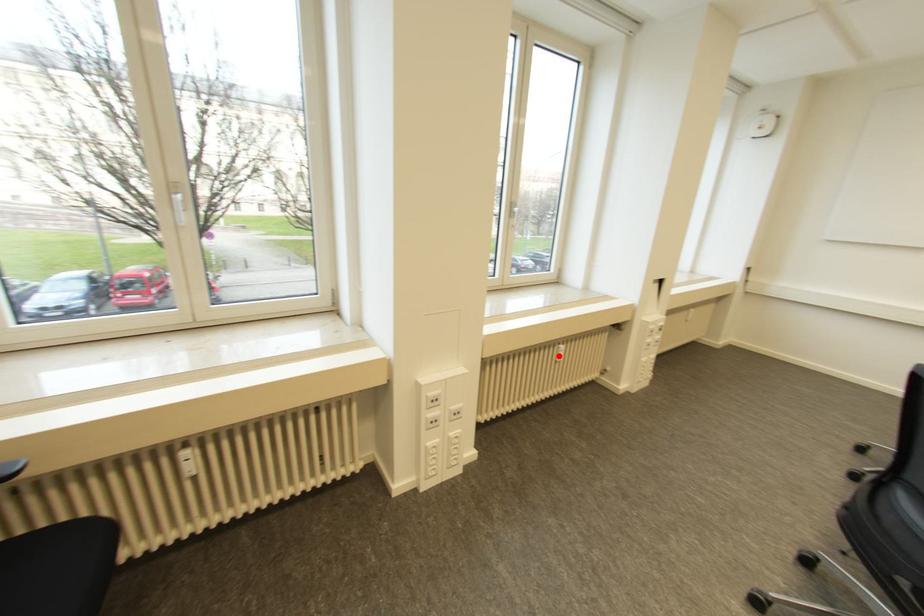
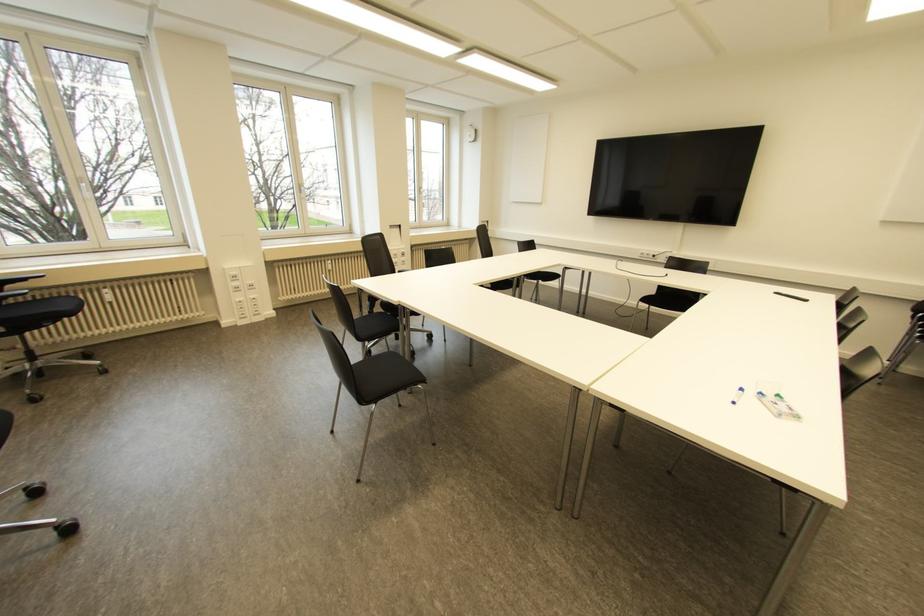
Question: I am providing you with two images of the same scene from different viewpoints. Image1 has a red point marked. In image2, the corresponding 3D location appears at what relative position? Reply with the corresponding letter.

Choices:
 (A) Closer
 (B) Farther

Answer: (B)